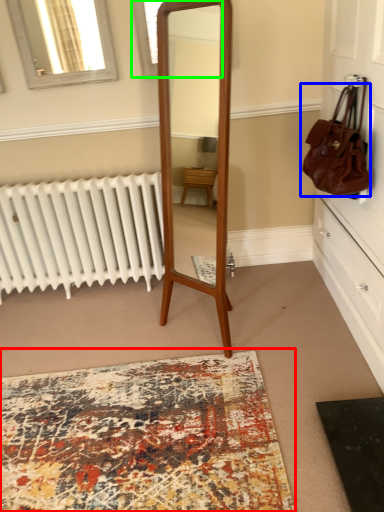
Question: Estimate the real-world distances between objects in this image. Which object is farther from mat (highlighted by a red box), handbag (highlighted by a blue box) or window (highlighted by a green box)?

Choices:
 (A) handbag
 (B) window

Answer: (B)